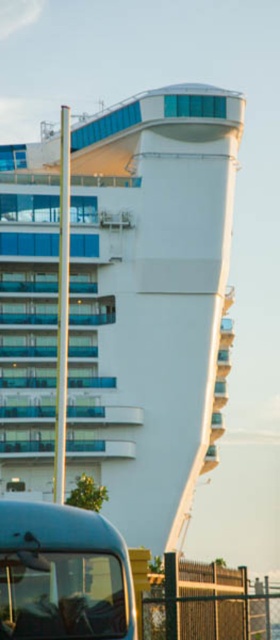
Question: Does white glossy cruise ship at center have a lesser width compared to metallic blue tour bus at lower left?

Choices:
 (A) yes
 (B) no

Answer: (B)

Question: Can you confirm if white glossy cruise ship at center is positioned to the left of metallic blue tour bus at lower left?

Choices:
 (A) yes
 (B) no

Answer: (A)

Question: Which point is farther to the camera?

Choices:
 (A) [71, 340]
 (B) [36, 557]

Answer: (A)

Question: Is white glossy cruise ship at center above metallic blue tour bus at lower left?

Choices:
 (A) no
 (B) yes

Answer: (B)

Question: Which point is farther to the camera?

Choices:
 (A) (73, 371)
 (B) (106, 544)

Answer: (A)

Question: Among these points, which one is nearest to the camera?

Choices:
 (A) (112, 388)
 (B) (33, 618)

Answer: (B)